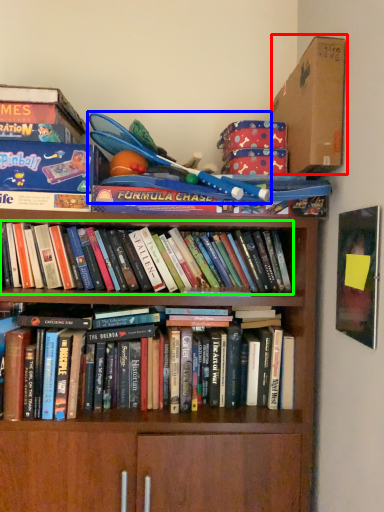
Question: Considering the real-world distances, which object is closest to cardboard box (highlighted by a red box)? toy (highlighted by a blue box) or book (highlighted by a green box).

Choices:
 (A) toy
 (B) book

Answer: (A)